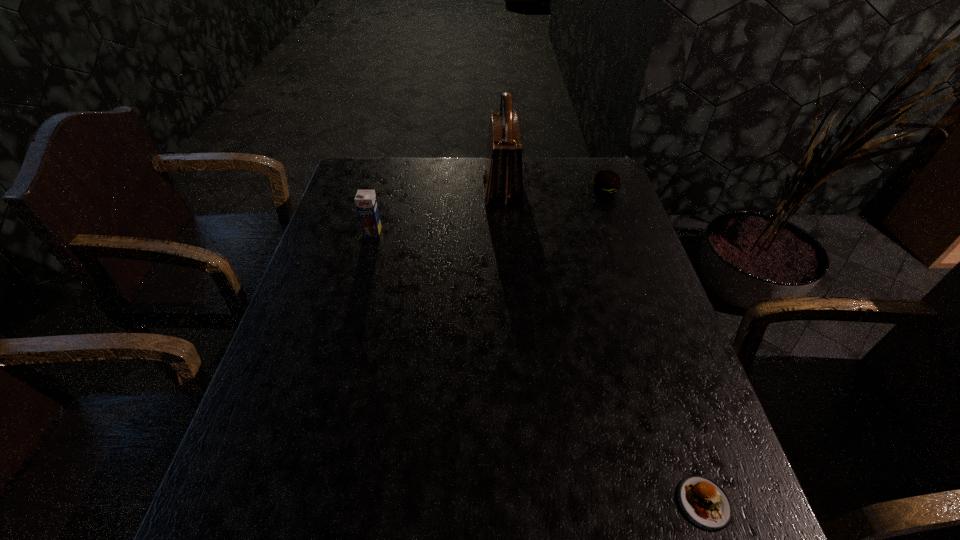
The width and height of the screenshot is (960, 540). Identify the location of vacant region at the far edge of the desktop. click(x=411, y=161).

What are the coordinates of `free space at the left edge` in the screenshot? It's located at (325, 246).

In the image, there is a desktop. Find the location of `vacant area at the right edge`. vacant area at the right edge is located at coordinates (635, 277).

The width and height of the screenshot is (960, 540). I want to click on vacant area that lies between the second tallest object and the third object from right to left, so click(438, 211).

Where is `free space between the shortest object and the taller patty (food)`? The height and width of the screenshot is (540, 960). free space between the shortest object and the taller patty (food) is located at coordinates (655, 347).

Find the location of a particular element. vacant space that is in between the shortest object and the shoulder bag is located at coordinates (603, 346).

Identify the location of free space between the second object from left to right and the taller patty (food). The image size is (960, 540). (553, 191).

This screenshot has width=960, height=540. Find the location of `vacant area that lies between the shortest object and the leftmost object`. vacant area that lies between the shortest object and the leftmost object is located at coordinates (539, 367).

The image size is (960, 540). Identify the location of vacant area between the shorter patty (food) and the third tallest object. (655, 347).

Where is `vacant region between the tallest object and the taller patty (food)`? vacant region between the tallest object and the taller patty (food) is located at coordinates (553, 191).